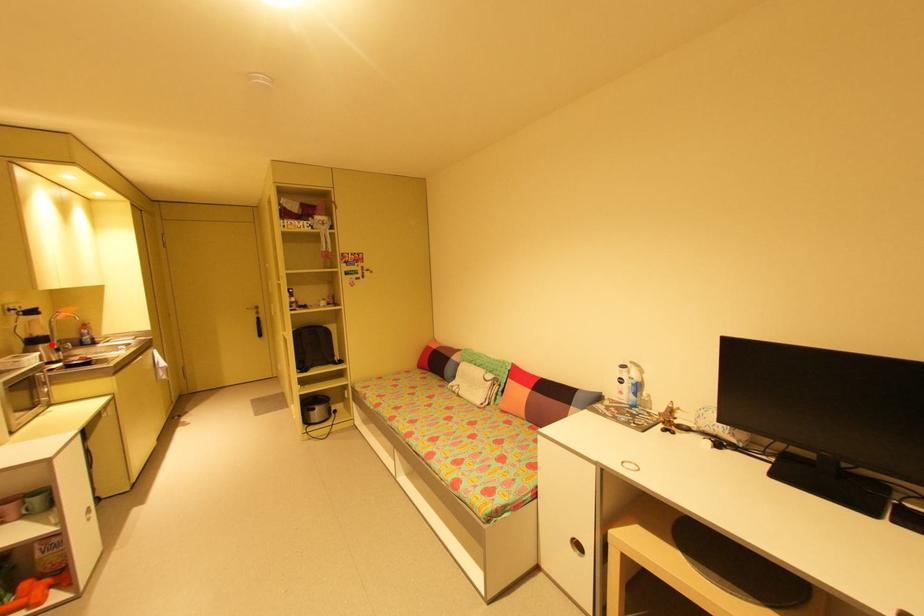
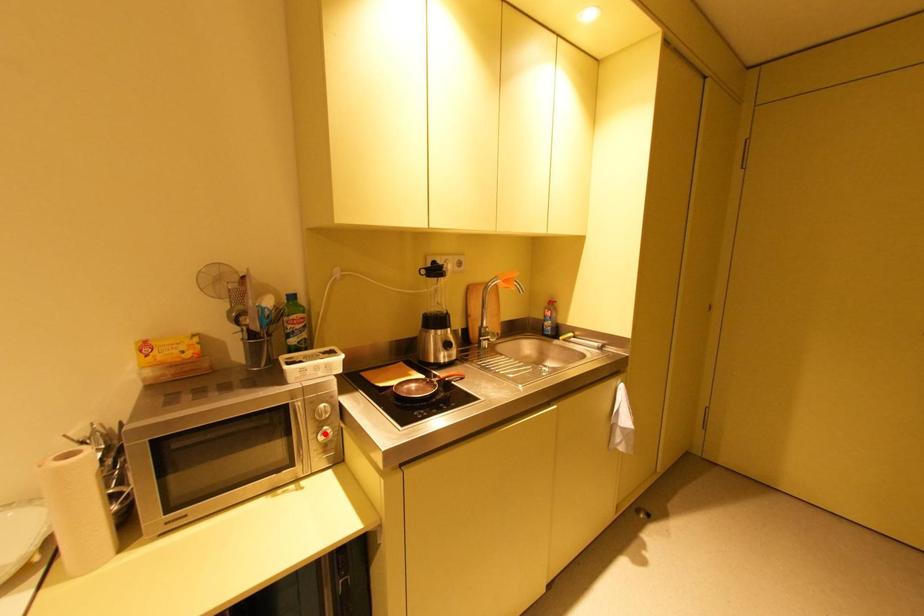
I am providing you with two images of the same scene from different viewpoints. A red point is marked on the first image and another point is marked on the second image. Does the point marked in image1 correspond to the same location as the one in image2?

No